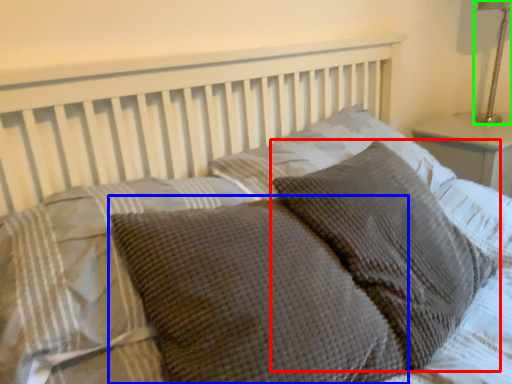
Question: Which object is the closest to the pillow (highlighted by a red box)? Choose among these: pillow (highlighted by a blue box) or bedside lamp (highlighted by a green box).

Choices:
 (A) pillow
 (B) bedside lamp

Answer: (A)